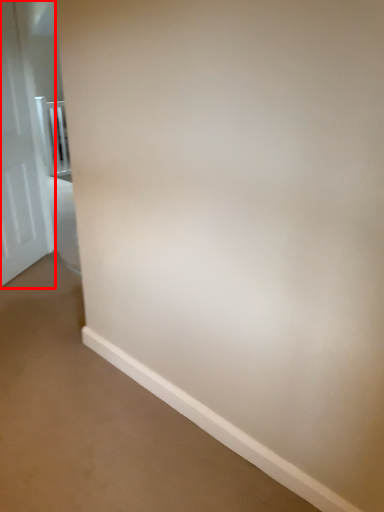
Question: In this image, where is door (annotated by the red box) located relative to balustrade?

Choices:
 (A) right
 (B) left

Answer: (A)